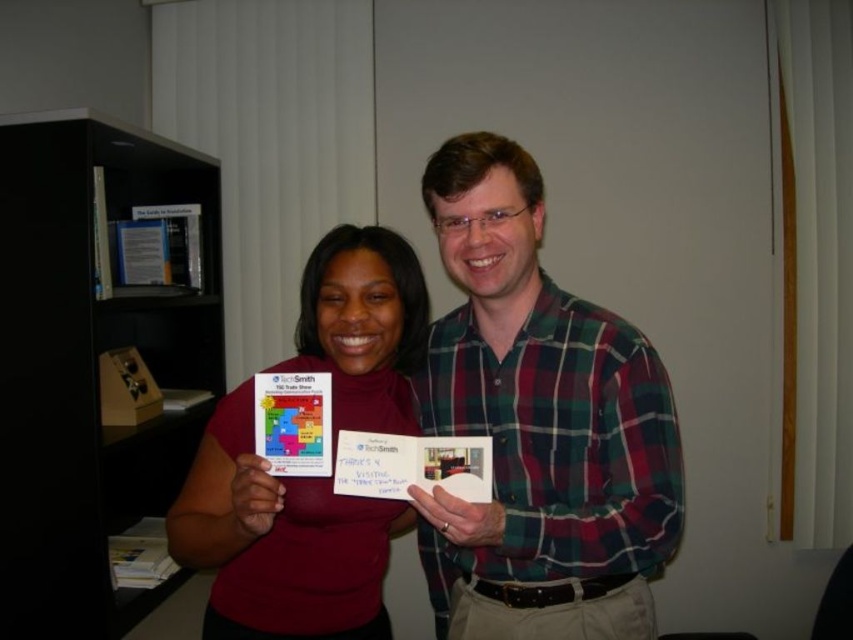
Looking at this image, you are a photographer trying to capture a clear shot of both the matte red shirt at center and the matte plastic card at center. Since you want to focus on the details of the card, which object should you adjust your camera focus to prioritize?

Since the matte red shirt at center has a greater height compared to the matte plastic card at center, you should adjust your camera focus to prioritize the matte plastic card at center to ensure its details are clear.

You are standing in front of the two people holding cards. You need to reach a point that is exactly 1.22 meters away from you. Can you determine if the point at coordinates point (210, 456) is at that distance?

The point at coordinates point (210, 456) is exactly 1.22 meters away from the camera, so yes, it is at the required distance.